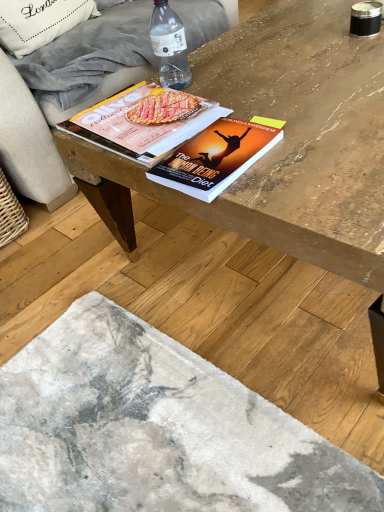
Where is `vacant space situated above hardcover book at center, arranged as the 1th book when viewed from the front (from a real-world perspective)`? The image size is (384, 512). vacant space situated above hardcover book at center, arranged as the 1th book when viewed from the front (from a real-world perspective) is located at coordinates (210, 159).